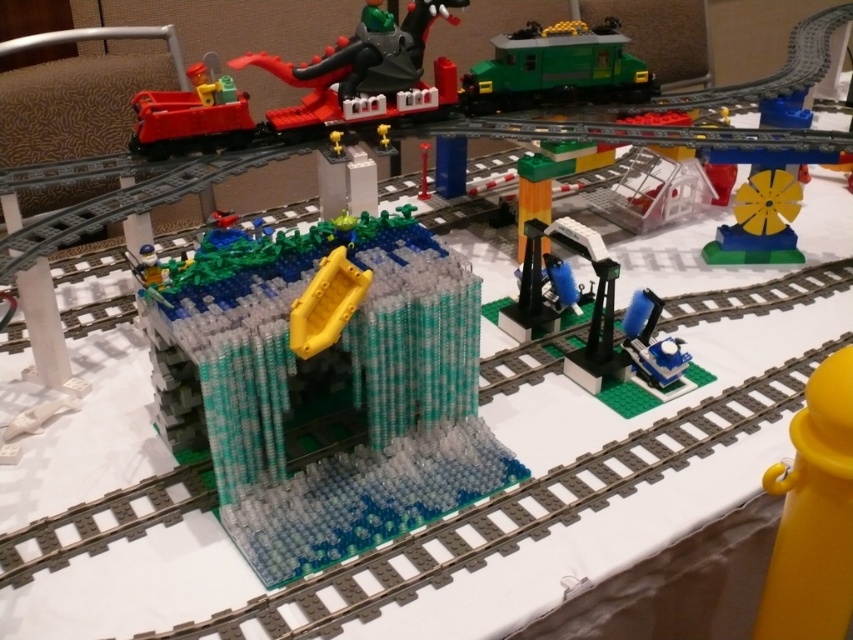
Who is higher up, transparent plastic waterfall at center or blue plastic train at right?

transparent plastic waterfall at center is above.

Is the position of transparent plastic waterfall at center more distant than that of blue plastic train at right?

No, transparent plastic waterfall at center is in front of blue plastic train at right.

Which is behind, point (450, 308) or point (675, 349)?

Positioned behind is point (675, 349).

At what (x,y) coordinates should I click in order to perform the action: click on transparent plastic waterfall at center. Please return your answer as a coordinate pair (x, y). Looking at the image, I should click on (335, 392).

Does yellow matte wheel at upper right appear under blue plastic train at right?

No.

Is yellow matte wheel at upper right to the left of blue plastic train at right from the viewer's perspective?

In fact, yellow matte wheel at upper right is to the right of blue plastic train at right.

The width and height of the screenshot is (853, 640). In order to click on yellow matte wheel at upper right in this screenshot , I will do `click(759, 221)`.

Where is `yellow matte wheel at upper right`? The image size is (853, 640). yellow matte wheel at upper right is located at coordinates (759, 221).

Is transparent plastic waterfall at center shorter than shiny black dragon at upper center?

Incorrect, transparent plastic waterfall at center's height does not fall short of shiny black dragon at upper center's.

Does point (466, 362) come behind point (316, 109)?

No.

This screenshot has height=640, width=853. In order to click on transparent plastic waterfall at center in this screenshot , I will do `click(335, 392)`.